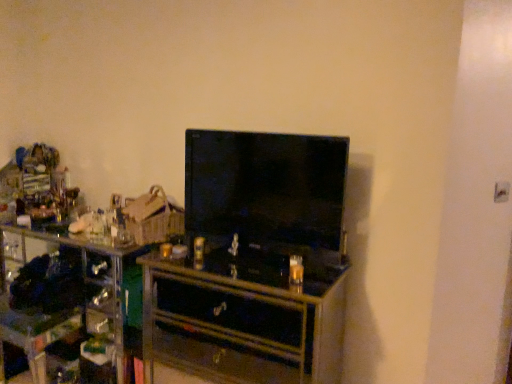
Question: Is wooden chest of drawers at center facing away from black glossy television at center?

Choices:
 (A) yes
 (B) no

Answer: (B)

Question: Does wooden chest of drawers at center have a larger size compared to black glossy television at center?

Choices:
 (A) yes
 (B) no

Answer: (A)

Question: Considering the relative sizes of wooden chest of drawers at center and black glossy television at center in the image provided, is wooden chest of drawers at center thinner than black glossy television at center?

Choices:
 (A) no
 (B) yes

Answer: (A)

Question: Is wooden chest of drawers at center to the right of black glossy television at center from the viewer's perspective?

Choices:
 (A) no
 (B) yes

Answer: (A)

Question: Would you say wooden chest of drawers at center is outside black glossy television at center?

Choices:
 (A) no
 (B) yes

Answer: (B)

Question: Is wooden chest of drawers at center closer to the viewer compared to black glossy television at center?

Choices:
 (A) yes
 (B) no

Answer: (A)

Question: Does black glossy television at center come behind wooden chest of drawers at center?

Choices:
 (A) yes
 (B) no

Answer: (A)

Question: Is black glossy television at center positioned in front of wooden chest of drawers at center?

Choices:
 (A) yes
 (B) no

Answer: (B)

Question: Would you say black glossy television at center is a long distance from wooden chest of drawers at center?

Choices:
 (A) yes
 (B) no

Answer: (B)

Question: Is black glossy television at center next to wooden chest of drawers at center and touching it?

Choices:
 (A) yes
 (B) no

Answer: (B)

Question: From the image's perspective, would you say black glossy television at center is positioned over wooden chest of drawers at center?

Choices:
 (A) yes
 (B) no

Answer: (A)

Question: From the image's perspective, does black glossy television at center appear lower than wooden chest of drawers at center?

Choices:
 (A) yes
 (B) no

Answer: (B)

Question: Which is correct: black glossy television at center is inside wooden chest of drawers at center, or outside of it?

Choices:
 (A) outside
 (B) inside

Answer: (A)